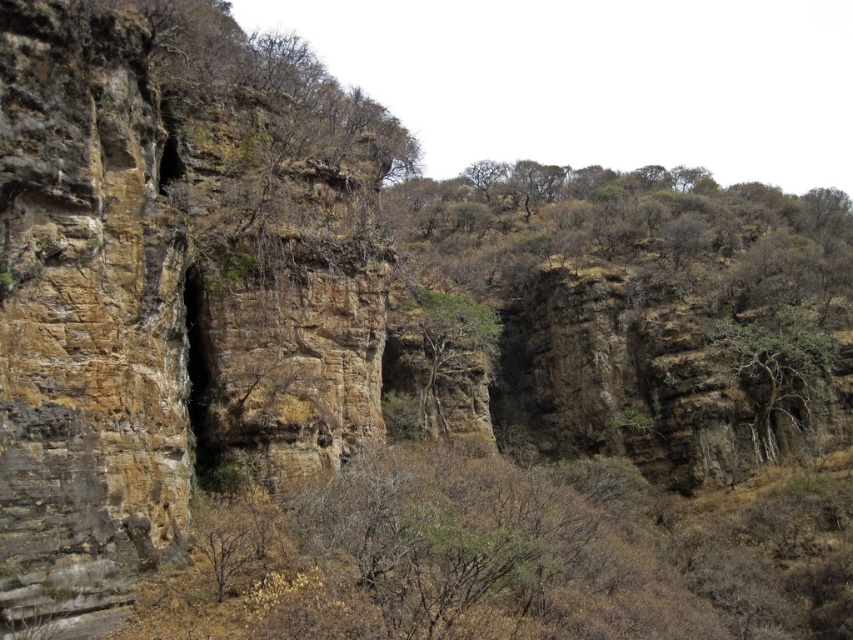
You are a hiker trying to identify the nearest tree to you in the scene. You see a green leafy tree at center and a brown textured tree at center. Which tree is closer to you?

The green leafy tree at center is closer to you because it is positioned in front of the brown textured tree at center.

Consider the image. You are standing at the base of the cliffs and want to reach the point marked at coordinates (477, 307). Given that the distance between your current position and the point is 90.88 meters, can you estimate how far you need to walk to reach it?

The distance between your current position and the point marked at coordinates (477, 307) is 90.88 meters, so you need to walk approximately 90.88 meters to reach it.